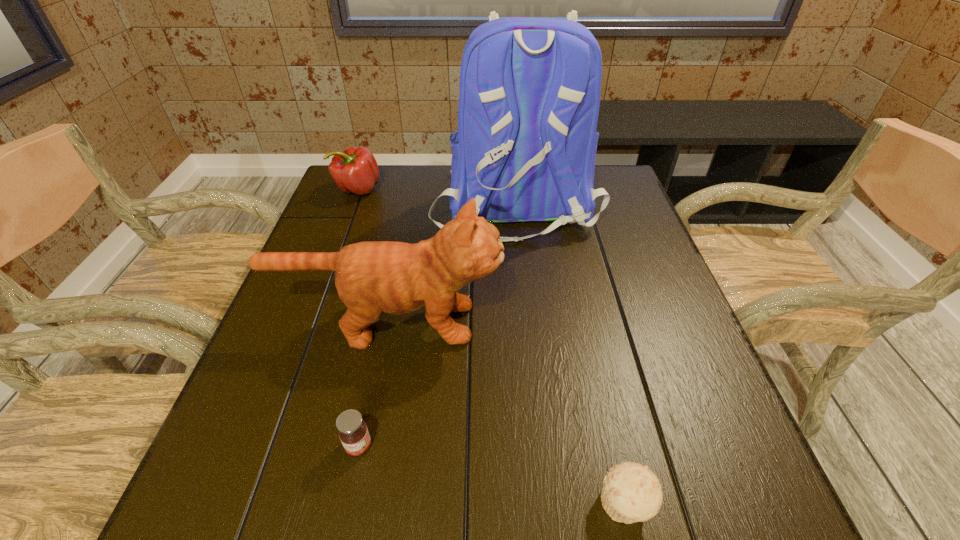
I want to click on vacant space situated on the right of the nearest object, so click(x=725, y=504).

The height and width of the screenshot is (540, 960). Identify the location of backpack at the far edge. coord(525,148).

Locate an element on the screen. pepper that is at the far edge is located at coordinates point(355,170).

Identify the location of object located at the near edge. (631, 492).

The image size is (960, 540). What are the coordinates of `cat that is positioned at the left edge` in the screenshot? It's located at (372, 277).

Locate an element on the screen. This screenshot has width=960, height=540. pepper that is at the left edge is located at coordinates (355, 170).

Identify the location of object present at the right edge. The width and height of the screenshot is (960, 540). (525, 148).

This screenshot has height=540, width=960. I want to click on object located in the far left corner section of the desktop, so click(355, 170).

Identify the location of object positioned at the far right corner. (525, 148).

The height and width of the screenshot is (540, 960). In the image, there is a desktop. Identify the location of blank space at the far edge. tap(443, 187).